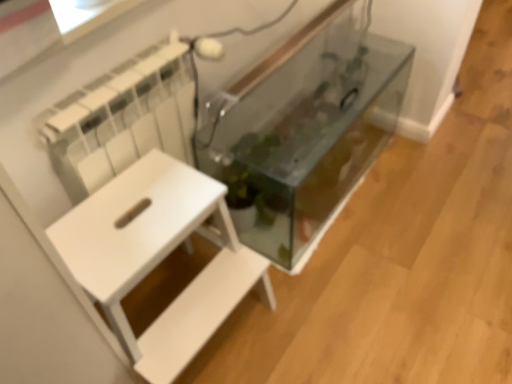
The image size is (512, 384). Find the location of `free space to the right of transparent glass tank at center`. free space to the right of transparent glass tank at center is located at coordinates click(x=438, y=189).